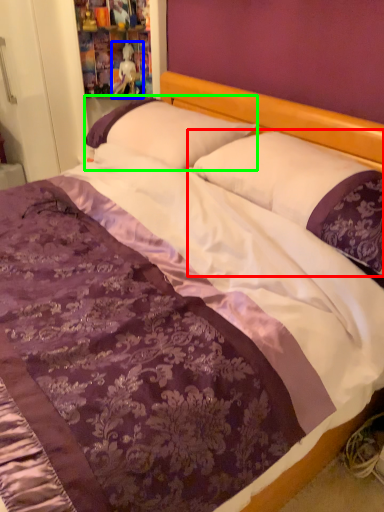
Question: Which object is the farthest from pillow (highlighted by a red box)? Choose among these: doll (highlighted by a blue box) or pillow (highlighted by a green box).

Choices:
 (A) doll
 (B) pillow

Answer: (A)